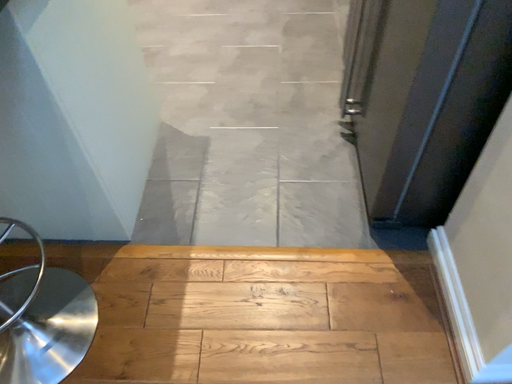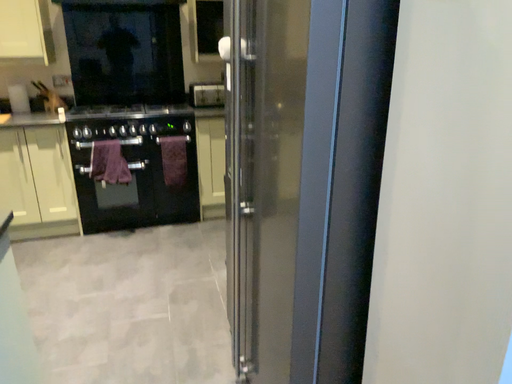
Question: How did the camera likely rotate when shooting the video?

Choices:
 (A) rotated left
 (B) rotated right

Answer: (B)